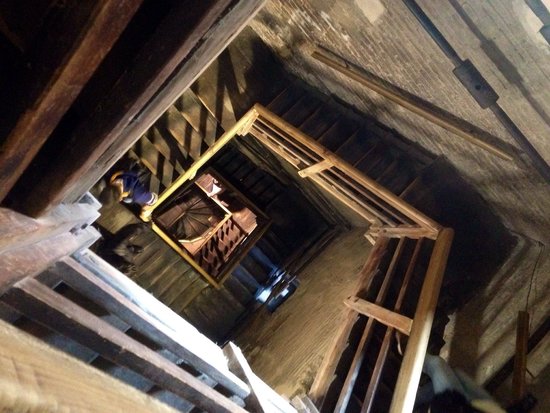
The image size is (550, 413). Find the location of `railing on wall`. railing on wall is located at coordinates (320, 58), (399, 100), (500, 152).